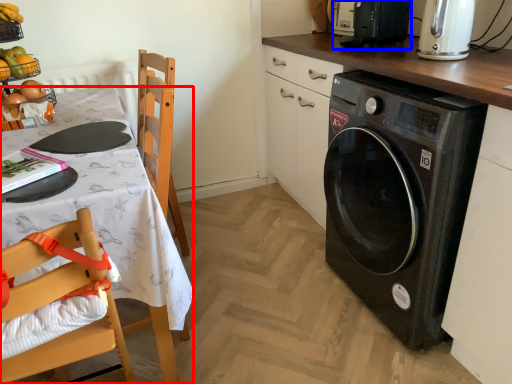
Question: Which object appears farthest to the camera in this image, desk (highlighted by a red box) or appliance (highlighted by a blue box)?

Choices:
 (A) desk
 (B) appliance

Answer: (B)